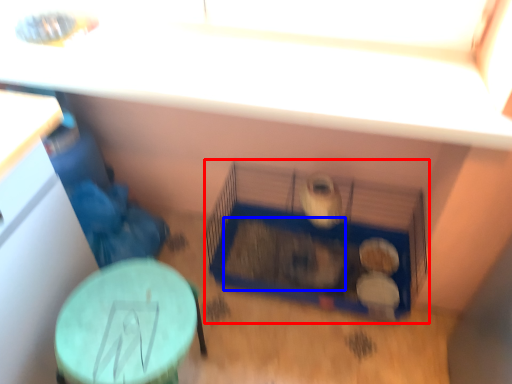
Question: Which of the following is the closest to the observer, bird cage (highlighted by a red box) or animal (highlighted by a blue box)?

Choices:
 (A) bird cage
 (B) animal

Answer: (A)